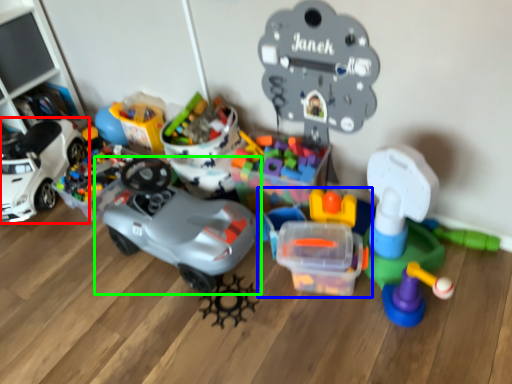
Question: Estimate the real-world distances between objects in this image. Which object is farther from car (highlighted by a red box), toy (highlighted by a blue box) or toy (highlighted by a green box)?

Choices:
 (A) toy
 (B) toy

Answer: (A)